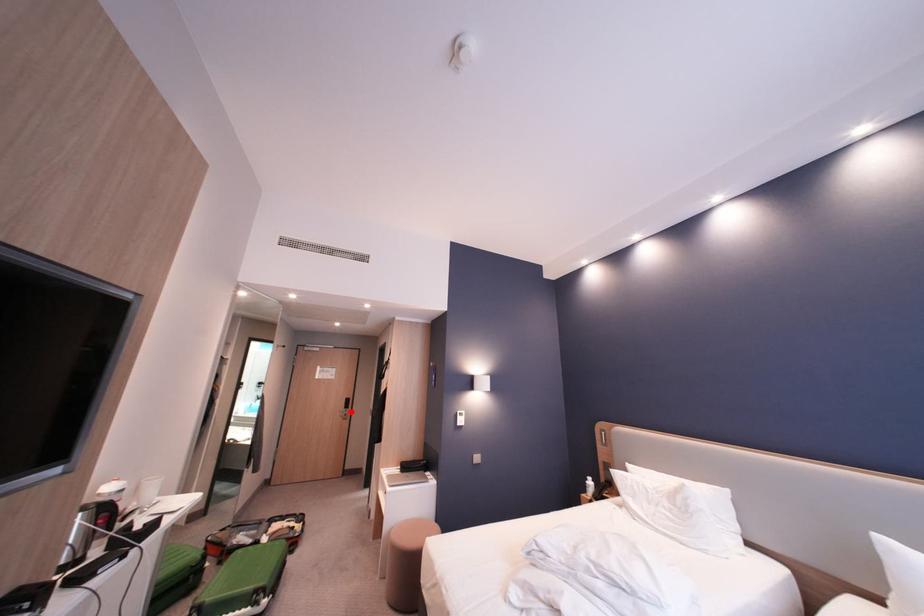
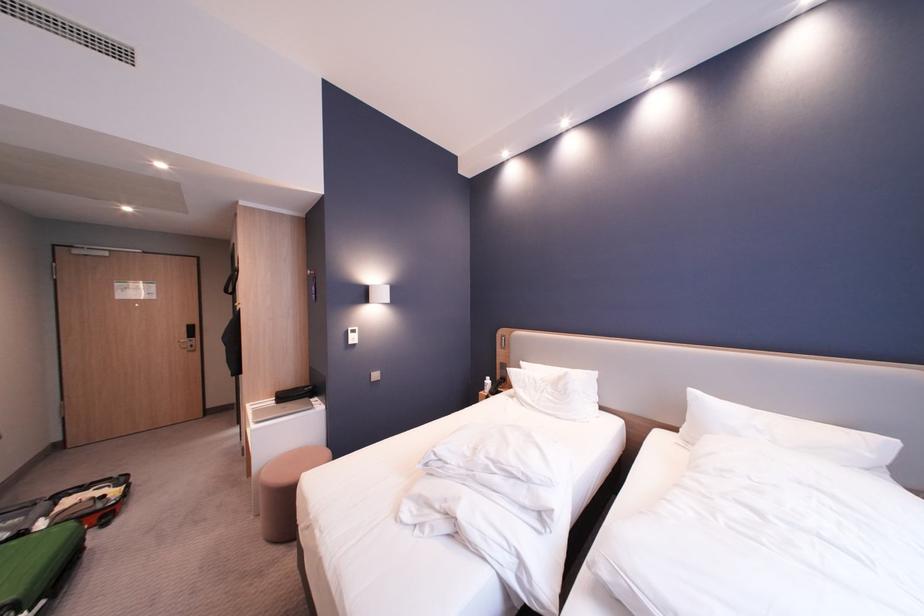
Locate, in the second image, the point that corresponds to the highlighted location in the first image.

(189, 342)